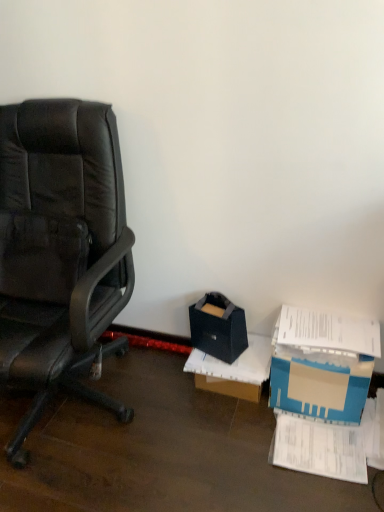
Question: Considering the relative sizes of blue cardboard box at lower right and cardboard box at center in the image provided, is blue cardboard box at lower right taller than cardboard box at center?

Choices:
 (A) yes
 (B) no

Answer: (A)

Question: Considering the relative sizes of blue cardboard box at lower right and cardboard box at center in the image provided, is blue cardboard box at lower right bigger than cardboard box at center?

Choices:
 (A) no
 (B) yes

Answer: (B)

Question: Is blue cardboard box at lower right facing away from cardboard box at center?

Choices:
 (A) no
 (B) yes

Answer: (A)

Question: Considering the relative sizes of blue cardboard box at lower right and cardboard box at center in the image provided, is blue cardboard box at lower right smaller than cardboard box at center?

Choices:
 (A) yes
 (B) no

Answer: (B)

Question: Is blue cardboard box at lower right closer to camera compared to cardboard box at center?

Choices:
 (A) yes
 (B) no

Answer: (A)

Question: From the image's perspective, is blue cardboard box at lower right above or below cardboard box at center?

Choices:
 (A) below
 (B) above

Answer: (B)

Question: Is point (339, 386) positioned closer to the camera than point (238, 394)?

Choices:
 (A) closer
 (B) farther

Answer: (A)

Question: Is blue cardboard box at lower right inside or outside of cardboard box at center?

Choices:
 (A) inside
 (B) outside

Answer: (B)

Question: Considering the positions of blue cardboard box at lower right and cardboard box at center in the image, is blue cardboard box at lower right taller or shorter than cardboard box at center?

Choices:
 (A) tall
 (B) short

Answer: (A)

Question: Looking at the image, does white paper at lower right seem bigger or smaller compared to matte black storage box at center?

Choices:
 (A) big
 (B) small

Answer: (B)

Question: In terms of width, does white paper at lower right look wider or thinner when compared to matte black storage box at center?

Choices:
 (A) wide
 (B) thin

Answer: (A)

Question: From a real-world perspective, relative to matte black storage box at center, is white paper at lower right vertically above or below?

Choices:
 (A) below
 (B) above

Answer: (A)

Question: Does point (327, 476) appear closer or farther from the camera than point (203, 335)?

Choices:
 (A) farther
 (B) closer

Answer: (B)

Question: Considering the positions of blue cardboard box at lower right and matte black storage box at center in the image, is blue cardboard box at lower right taller or shorter than matte black storage box at center?

Choices:
 (A) short
 (B) tall

Answer: (B)

Question: In terms of size, does blue cardboard box at lower right appear bigger or smaller than matte black storage box at center?

Choices:
 (A) big
 (B) small

Answer: (A)